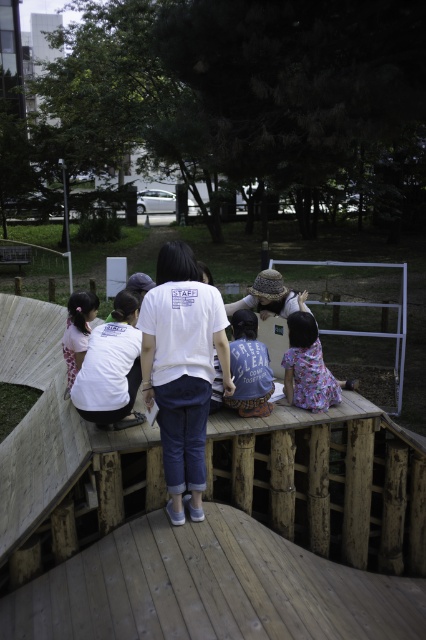
Does denim shirt at center have a larger size compared to white floral dress at lower left?

No.

Is denim shirt at center shorter than white floral dress at lower left?

Indeed, denim shirt at center has a lesser height compared to white floral dress at lower left.

Which is in front, point (250, 328) or point (89, 304)?

Point (250, 328) is more forward.

Find the location of a particular element. This screenshot has width=426, height=640. denim shirt at center is located at coordinates (249, 368).

Which is behind, point (195, 340) or point (134, 384)?

Positioned behind is point (134, 384).

Is white matte t-shirt at center smaller than white matte shirt at lower left?

No, white matte t-shirt at center is not smaller than white matte shirt at lower left.

Is point (141, 362) closer to viewer compared to point (120, 422)?

That is True.

The height and width of the screenshot is (640, 426). I want to click on white matte t-shirt at center, so click(181, 369).

Is white matte shirt at lower left below denim shirt at center?

No.

Is white matte shirt at lower left shorter than denim shirt at center?

Incorrect, white matte shirt at lower left's height does not fall short of denim shirt at center's.

Is point (112, 323) positioned after point (244, 380)?

Yes, it is behind point (244, 380).

This screenshot has height=640, width=426. Find the location of `white matte shirt at lower left`. white matte shirt at lower left is located at coordinates (112, 369).